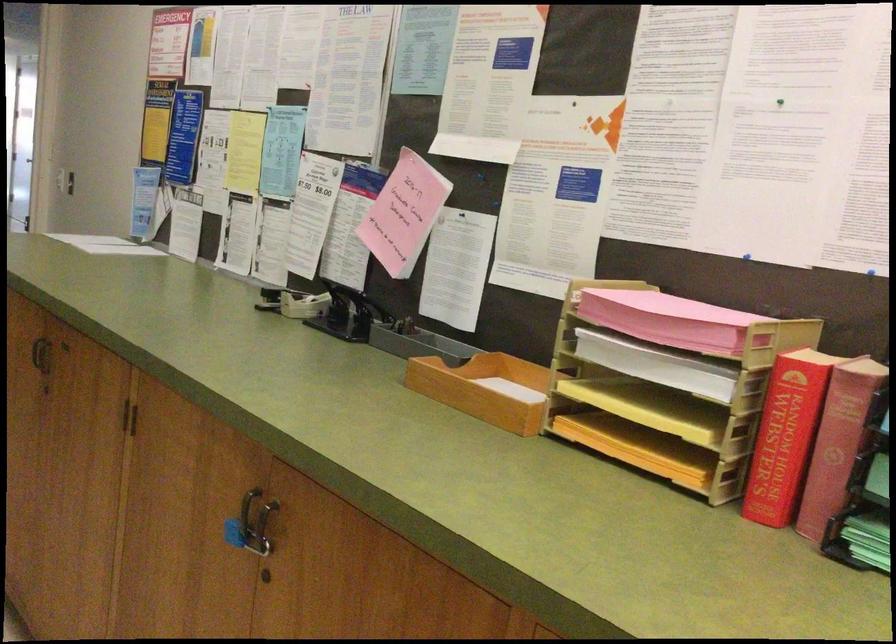
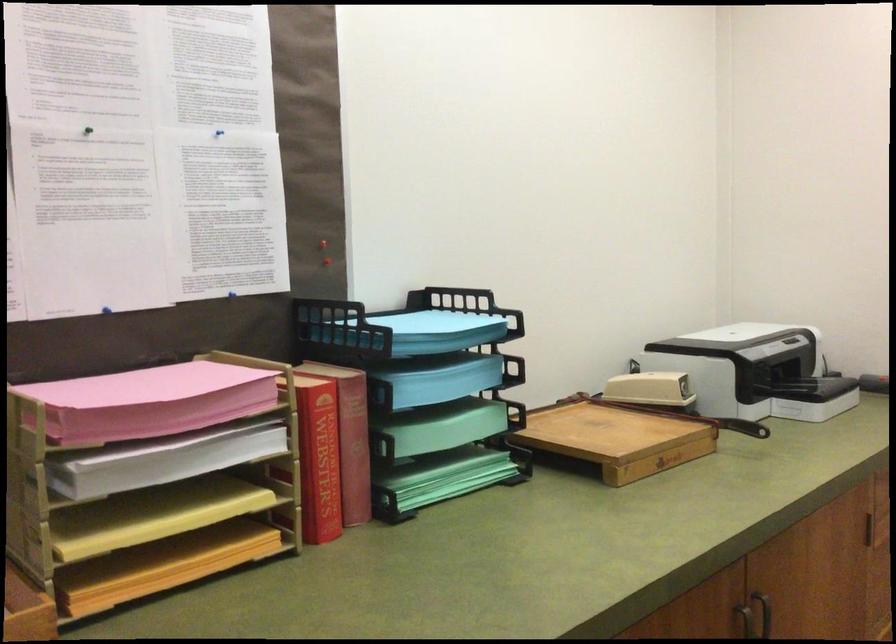
In the second image, find the point that corresponds to the point at 668,317 in the first image.

(171, 406)